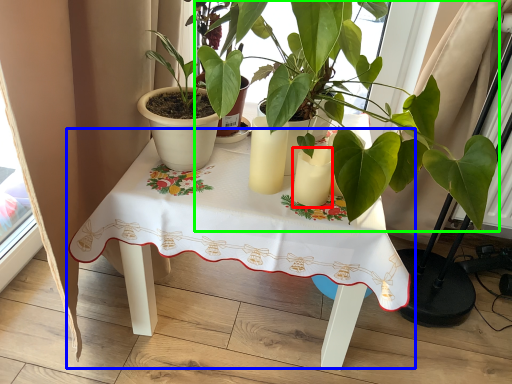
Question: Which is nearer to the candle holder (highlighted by a red box)? table (highlighted by a blue box) or houseplant (highlighted by a green box).

Choices:
 (A) table
 (B) houseplant

Answer: (B)